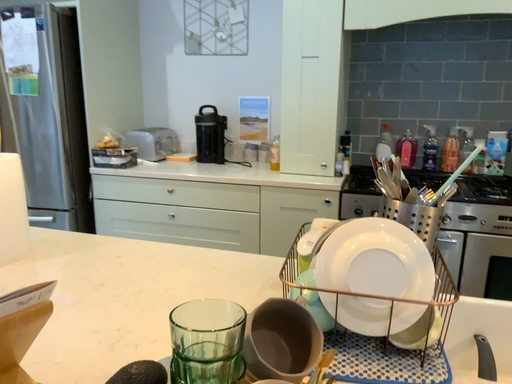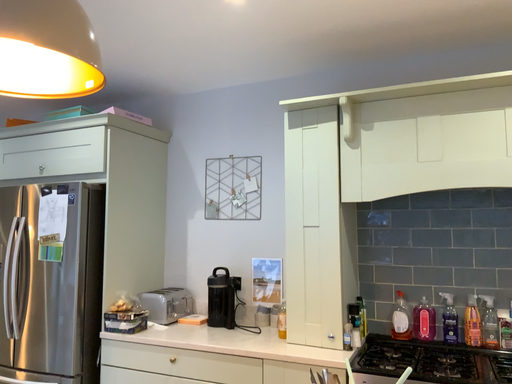
Question: Which way did the camera rotate in the video?

Choices:
 (A) rotated downward
 (B) rotated upward

Answer: (B)